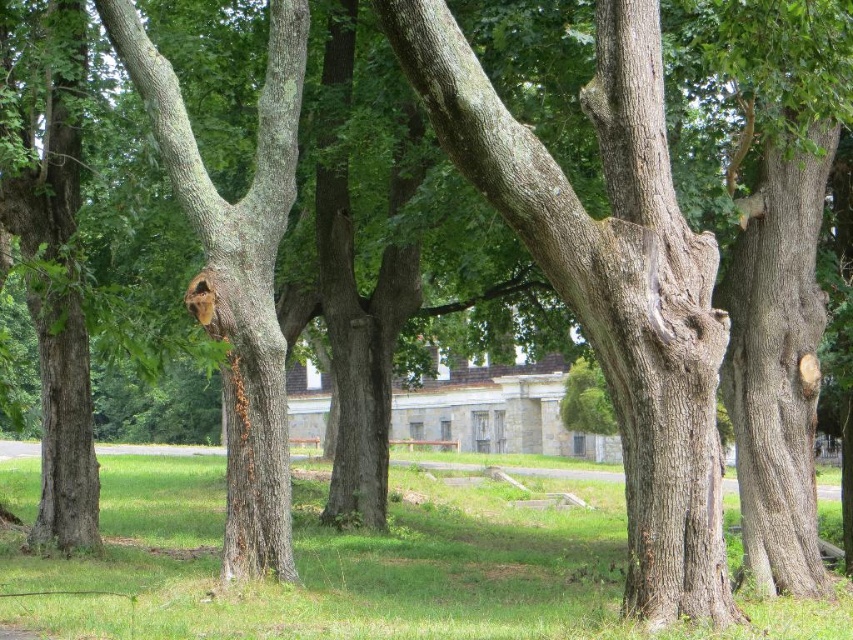
Question: Can you confirm if green grass at center is smaller than smooth bark tree at center?

Choices:
 (A) no
 (B) yes

Answer: (A)

Question: Is green grass at center above smooth bark tree at center?

Choices:
 (A) no
 (B) yes

Answer: (A)

Question: Considering the relative positions of green grass at center and smooth bark tree at center in the image provided, where is green grass at center located with respect to smooth bark tree at center?

Choices:
 (A) above
 (B) below

Answer: (B)

Question: Which point is farther to the camera?

Choices:
 (A) (219, 611)
 (B) (248, 314)

Answer: (B)

Question: Which point appears closest to the camera in this image?

Choices:
 (A) click(132, 33)
 (B) click(152, 529)

Answer: (A)